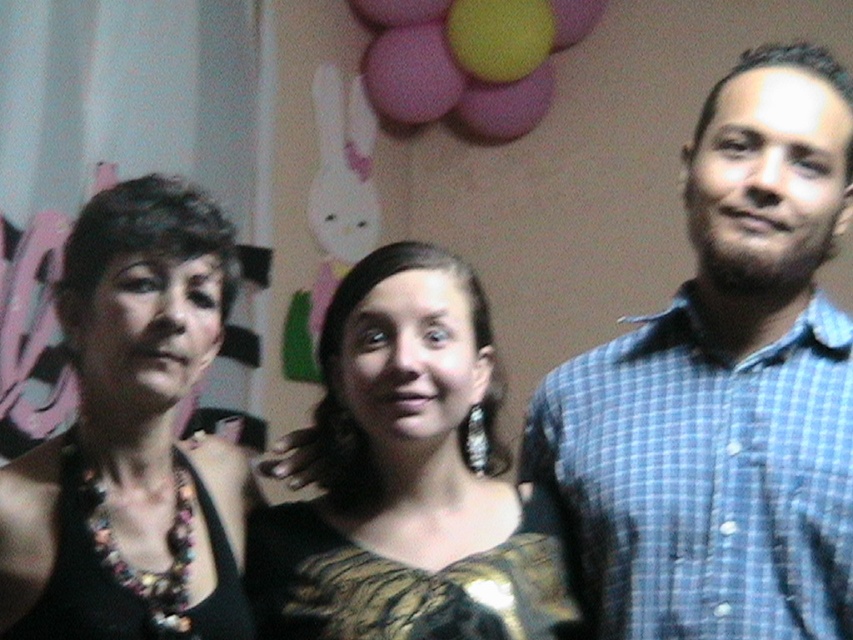
Between black dress at center and gold textured dress at center, which one has more height?

Standing taller between the two is black dress at center.

Where is `black dress at center`? black dress at center is located at coordinates (392, 488).

Identify the location of black dress at center. The height and width of the screenshot is (640, 853). (392, 488).

Measure the distance between black matte necklace at left and pink matte balloon at upper center.

black matte necklace at left and pink matte balloon at upper center are 7.21 feet apart.

Does point (32, 625) come closer to viewer compared to point (398, 104)?

Yes, point (32, 625) is in front of point (398, 104).

Which is behind, point (102, 426) or point (444, 109)?

The point (444, 109) is behind.

This screenshot has width=853, height=640. Identify the location of black matte necklace at left. (157, 387).

Which is in front, point (744, 564) or point (534, 68)?

Point (744, 564) is more forward.

Is blue checkered shirt at right closer to camera compared to pink matte balloon at upper center?

Yes, blue checkered shirt at right is closer to the viewer.

Who is more distant from viewer, (795,250) or (485,28)?

Positioned behind is point (485,28).

Where is `blue checkered shirt at right`? This screenshot has width=853, height=640. blue checkered shirt at right is located at coordinates (724, 388).